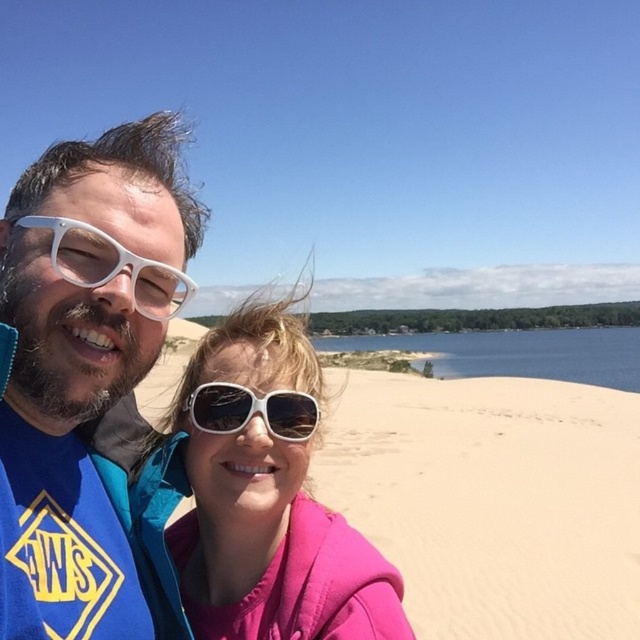
You are taking a photo of two people on a sandy dune near a lake. You notice a point marked at coordinates (x=90, y=385). What object is located at that point?

The point at coordinates (x=90, y=385) marks the location of white matte sunglasses at upper left.

You are taking a photo of the sandy yellow sand at center from a distance. Where would you point your camera to capture it in the frame?

To capture the sandy yellow sand at center, point your camera towards the center of the scene where it is located at coordinates approximately 0.780 on the x and 0.769 on the y axis.